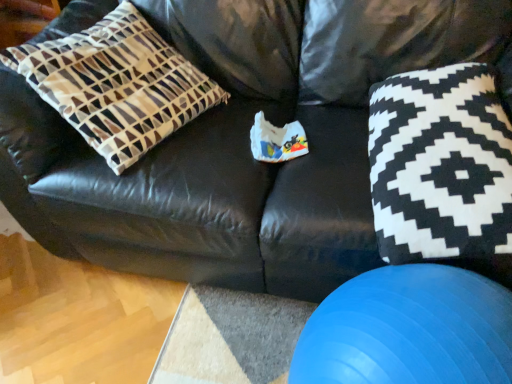
Question: Is black and white fabric pillow at right turned away from blue rubber ball at lower right?

Choices:
 (A) no
 (B) yes

Answer: (A)

Question: Is black and white fabric pillow at right touching blue rubber ball at lower right?

Choices:
 (A) no
 (B) yes

Answer: (A)

Question: From a real-world perspective, is black and white fabric pillow at right physically above blue rubber ball at lower right?

Choices:
 (A) yes
 (B) no

Answer: (A)

Question: Can you confirm if black and white fabric pillow at right is positioned to the right of blue rubber ball at lower right?

Choices:
 (A) yes
 (B) no

Answer: (A)

Question: Is black and white fabric pillow at right smaller than blue rubber ball at lower right?

Choices:
 (A) yes
 (B) no

Answer: (A)

Question: Is black and white fabric pillow at right facing towards blue rubber ball at lower right?

Choices:
 (A) yes
 (B) no

Answer: (A)

Question: Is blue rubber ball at lower right turned away from black and white fabric pillow at right?

Choices:
 (A) yes
 (B) no

Answer: (A)

Question: Does blue rubber ball at lower right have a greater height compared to black and white fabric pillow at right?

Choices:
 (A) yes
 (B) no

Answer: (A)

Question: Is blue rubber ball at lower right shorter than black and white fabric pillow at right?

Choices:
 (A) no
 (B) yes

Answer: (A)

Question: Is blue rubber ball at lower right facing towards black and white fabric pillow at right?

Choices:
 (A) yes
 (B) no

Answer: (B)

Question: Considering the relative positions of blue rubber ball at lower right and black and white fabric pillow at right in the image provided, is blue rubber ball at lower right to the left of black and white fabric pillow at right from the viewer's perspective?

Choices:
 (A) yes
 (B) no

Answer: (A)

Question: Is blue rubber ball at lower right thinner than black and white fabric pillow at right?

Choices:
 (A) yes
 (B) no

Answer: (A)

Question: Considering the relative sizes of blue rubber ball at lower right and brown and white geometric pillow at left in the image provided, is blue rubber ball at lower right bigger than brown and white geometric pillow at left?

Choices:
 (A) no
 (B) yes

Answer: (A)